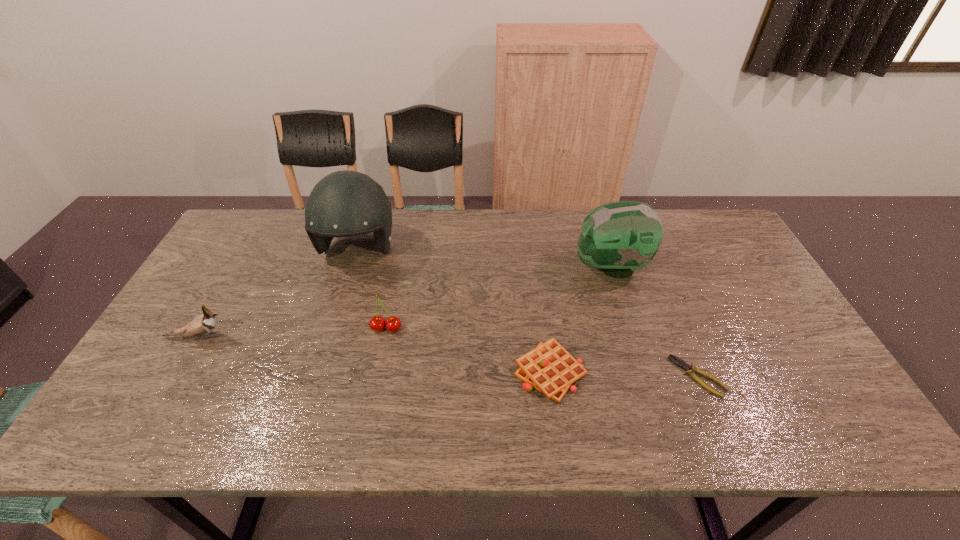
The image size is (960, 540). I want to click on free space between the second shortest object and the cherry, so click(468, 350).

Image resolution: width=960 pixels, height=540 pixels. What are the coordinates of `free space between the fifth shortest object and the cherry` in the screenshot? It's located at (498, 298).

Locate which object ranks fifth in proximity to the leftmost object. Please provide its 2D coordinates. Your answer should be formatted as a tuple, i.e. [(x, y)], where the tuple contains the x and y coordinates of a point satisfying the conditions above.

[(690, 370)]

Identify which object is the nearest to the tallest object. Please provide its 2D coordinates. Your answer should be formatted as a tuple, i.e. [(x, y)], where the tuple contains the x and y coordinates of a point satisfying the conditions above.

[(377, 323)]

The height and width of the screenshot is (540, 960). I want to click on free point that satisfies the following two spatial constraints: 1. on the back side of the pliers; 2. on the visor of the right football helmet, so click(x=653, y=267).

Where is `vacant region that satisfies the following two spatial constraints: 1. at the face opening of the taller football helmet; 2. at the face of the bird`? This screenshot has height=540, width=960. vacant region that satisfies the following two spatial constraints: 1. at the face opening of the taller football helmet; 2. at the face of the bird is located at coordinates (331, 338).

You are a GUI agent. You are given a task and a screenshot of the screen. Output one action in this format:
    pyautogui.click(x=<x>, y=<y>)
    Task: Click on the vacant position in the image that satisfies the following two spatial constraints: 1. at the face of the leftmost object; 2. on the right side of the fourth object from left to right
    
    Given the screenshot: What is the action you would take?
    pyautogui.click(x=179, y=372)

Image resolution: width=960 pixels, height=540 pixels. In order to click on vacant region that satisfies the following two spatial constraints: 1. on the back side of the waffle; 2. at the face of the leftmost object in this screenshot , I will do `click(545, 338)`.

Locate an element on the screen. The height and width of the screenshot is (540, 960). free space that satisfies the following two spatial constraints: 1. with the stems of the cherry pointing upwards; 2. on the left side of the shortest object is located at coordinates (377, 376).

You are a GUI agent. You are given a task and a screenshot of the screen. Output one action in this format:
    pyautogui.click(x=<x>, y=<y>)
    Task: Click on the free space that satisfies the following two spatial constraints: 1. with the stems of the third object from right to left pointing upwards; 2. on the right side of the cherry
    Image resolution: width=960 pixels, height=540 pixels.
    Given the screenshot: What is the action you would take?
    (378, 372)